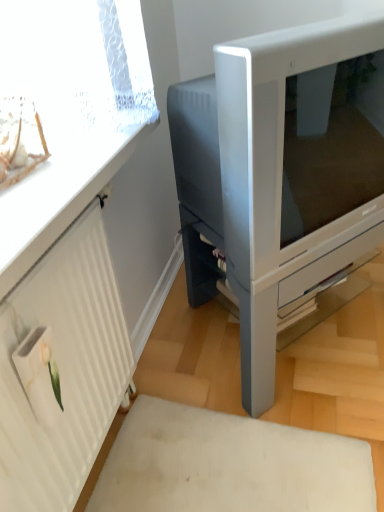
Question: Could you tell me if satin silver monitor at center is turned towards clear plastic window screen at upper left?

Choices:
 (A) no
 (B) yes

Answer: (A)

Question: Is satin silver monitor at center further to camera compared to clear plastic window screen at upper left?

Choices:
 (A) no
 (B) yes

Answer: (B)

Question: Is satin silver monitor at center shorter than clear plastic window screen at upper left?

Choices:
 (A) no
 (B) yes

Answer: (A)

Question: Considering the relative sizes of satin silver monitor at center and clear plastic window screen at upper left in the image provided, is satin silver monitor at center taller than clear plastic window screen at upper left?

Choices:
 (A) no
 (B) yes

Answer: (B)

Question: Is satin silver monitor at center in front of clear plastic window screen at upper left?

Choices:
 (A) no
 (B) yes

Answer: (A)

Question: Is satin silver monitor at center taller or shorter than white textured radiator at left?

Choices:
 (A) tall
 (B) short

Answer: (B)

Question: From the image's perspective, is satin silver monitor at center above or below white textured radiator at left?

Choices:
 (A) above
 (B) below

Answer: (A)

Question: Visually, is satin silver monitor at center positioned to the left or to the right of white textured radiator at left?

Choices:
 (A) right
 (B) left

Answer: (A)

Question: From a real-world perspective, is satin silver monitor at center positioned above or below white textured radiator at left?

Choices:
 (A) above
 (B) below

Answer: (B)

Question: From a real-world perspective, is white textured radiator at left above or below clear plastic window screen at upper left?

Choices:
 (A) above
 (B) below

Answer: (B)

Question: Considering the positions of white textured radiator at left and clear plastic window screen at upper left in the image, is white textured radiator at left taller or shorter than clear plastic window screen at upper left?

Choices:
 (A) tall
 (B) short

Answer: (A)

Question: Is white textured radiator at left to the left or to the right of clear plastic window screen at upper left in the image?

Choices:
 (A) left
 (B) right

Answer: (B)

Question: Is white textured radiator at left inside or outside of clear plastic window screen at upper left?

Choices:
 (A) inside
 (B) outside

Answer: (B)

Question: Relative to satin silver monitor at center, is clear plastic window screen at upper left in front or behind?

Choices:
 (A) front
 (B) behind

Answer: (A)

Question: Does point (41, 118) appear closer or farther from the camera than point (172, 126)?

Choices:
 (A) farther
 (B) closer

Answer: (B)